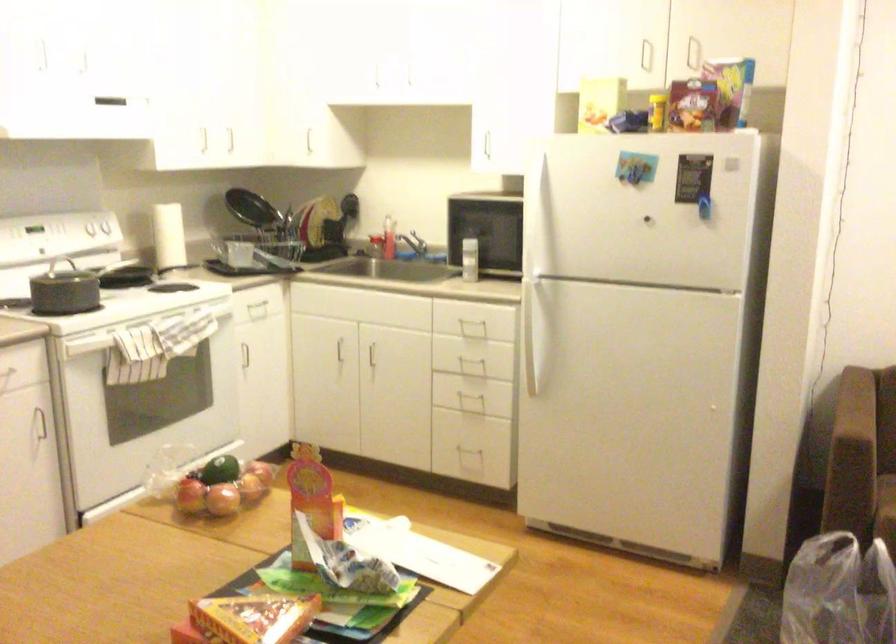
Where is `oven door handle`? The height and width of the screenshot is (644, 896). oven door handle is located at coordinates (174, 382).